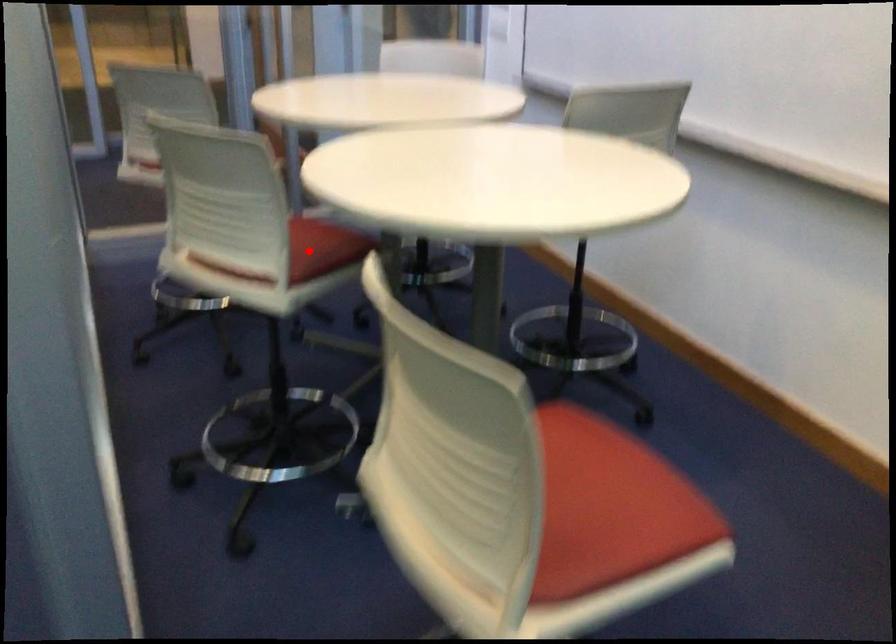
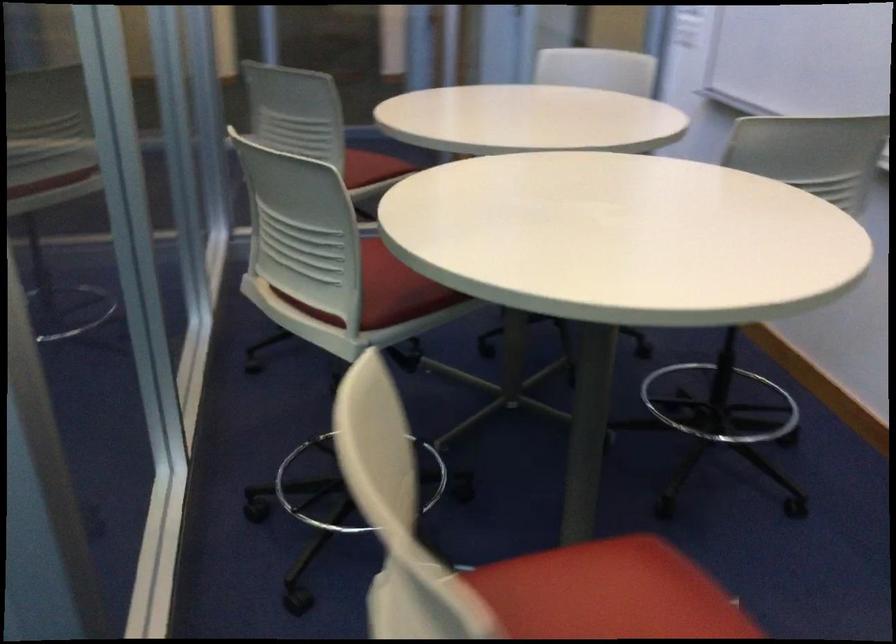
Question: A red point is marked in image1. In image2, is the corresponding 3D point closer to the camera or farther? Reply with the corresponding letter.

Choices:
 (A) The corresponding 3D point is closer.
 (B) The corresponding 3D point is farther.

Answer: (A)